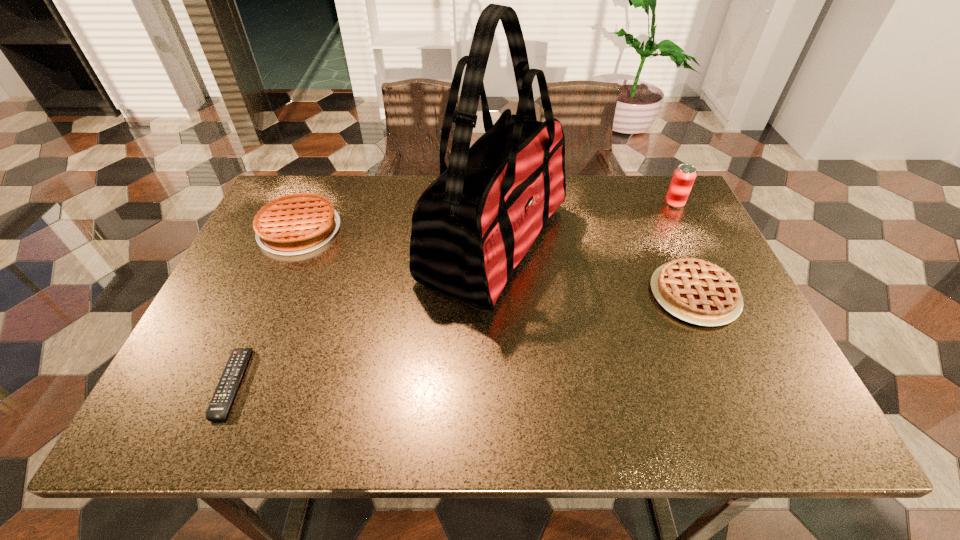
Where is `beer can that is at the right edge`? beer can that is at the right edge is located at coordinates (684, 176).

The height and width of the screenshot is (540, 960). Find the location of `pie at the right edge`. pie at the right edge is located at coordinates (699, 292).

The image size is (960, 540). In order to click on object positioned at the far left corner in this screenshot , I will do `click(298, 223)`.

I want to click on object that is at the near left corner, so click(218, 408).

This screenshot has width=960, height=540. I want to click on object positioned at the far right corner, so click(x=684, y=176).

In the image, there is a desktop. Where is `vacant space at the far edge`? This screenshot has height=540, width=960. vacant space at the far edge is located at coordinates (390, 200).

Identify the location of free location at the near edge of the desktop. This screenshot has width=960, height=540. (631, 405).

Locate an element on the screen. This screenshot has height=540, width=960. blank space at the left edge of the desktop is located at coordinates (207, 358).

You are a GUI agent. You are given a task and a screenshot of the screen. Output one action in this format:
    pyautogui.click(x=<x>, y=<y>)
    Task: Click on the free space at the right edge of the desktop
    The height and width of the screenshot is (540, 960).
    Given the screenshot: What is the action you would take?
    pyautogui.click(x=753, y=370)

The height and width of the screenshot is (540, 960). What are the coordinates of `free point at the near left corner` in the screenshot? It's located at (212, 425).